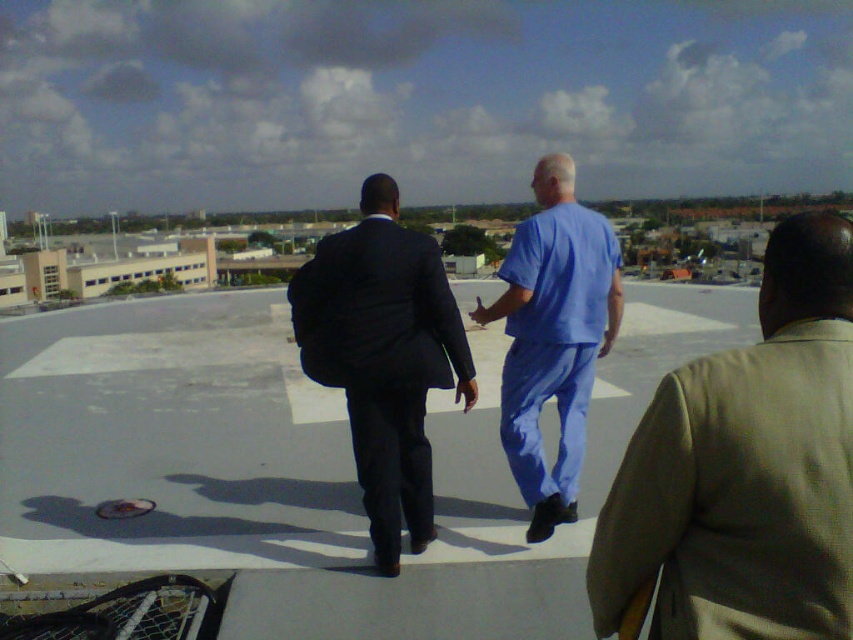
You are standing at the point labeled point (436, 337) and want to walk to the point labeled point (813, 636). Which direction should you face to walk straight towards your destination?

You should face towards the direction of the point labeled point (813, 636), which is in front of your current position at point (436, 337). Since point (813, 636) is in front of point (436, 337), you should face forward to walk straight towards it.